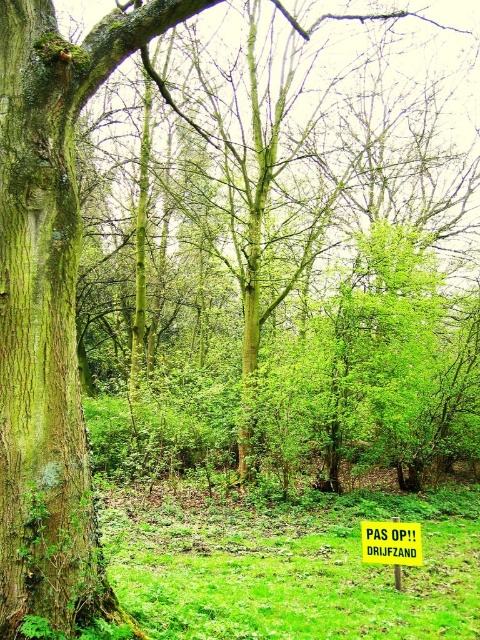
Question: Which point appears farthest from the camera in this image?

Choices:
 (A) (414, 552)
 (B) (227, 612)

Answer: (A)

Question: Does green grass at lower center appear on the left side of yellow rectangular sign at center?

Choices:
 (A) yes
 (B) no

Answer: (A)

Question: Is green grass at lower center in front of yellow rectangular sign at center?

Choices:
 (A) yes
 (B) no

Answer: (A)

Question: In this image, where is green grass at lower center located relative to yellow rectangular sign at center?

Choices:
 (A) below
 (B) above

Answer: (A)

Question: Which point is farther to the camera?

Choices:
 (A) yellow rectangular sign at center
 (B) green grass at lower center

Answer: (A)